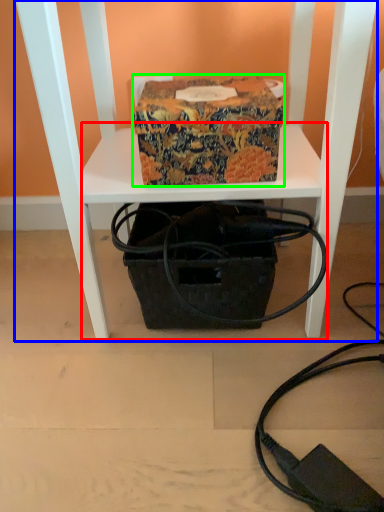
Question: Which object is positioned farthest from table (highlighted by a red box)? Select from furniture (highlighted by a blue box) and cardboard box (highlighted by a green box).

Choices:
 (A) furniture
 (B) cardboard box

Answer: (B)